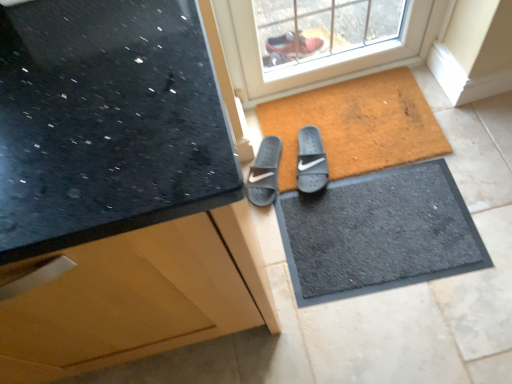
I want to click on vacant area that is in front of brown textured mat at center, so click(386, 239).